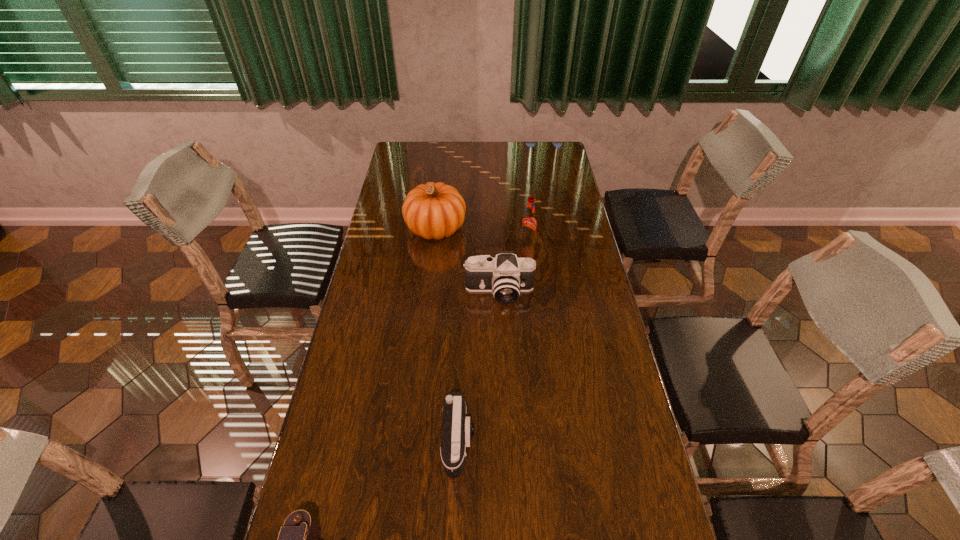
In order to click on vacant space at the far edge of the desktop in this screenshot , I will do `click(458, 144)`.

In the image, there is a desktop. Identify the location of free space at the left edge. Image resolution: width=960 pixels, height=540 pixels. (372, 286).

Locate an element on the screen. vacant region at the right edge of the desktop is located at coordinates (573, 252).

Image resolution: width=960 pixels, height=540 pixels. Identify the location of vacant region at the far right corner of the desktop. (553, 164).

Locate an element on the screen. The height and width of the screenshot is (540, 960). vacant area between the pumpkin and the second farthest camera is located at coordinates (447, 335).

Where is `vacant area that lies between the tallest camera and the second nearest camera`? This screenshot has height=540, width=960. vacant area that lies between the tallest camera and the second nearest camera is located at coordinates (479, 367).

The width and height of the screenshot is (960, 540). I want to click on object that is the second closest to the second nearest camera, so 506,276.

Select which object is the fourth closest to the nearest camera. Please provide its 2D coordinates. Your answer should be formatted as a tuple, i.e. [(x, y)], where the tuple contains the x and y coordinates of a point satisfying the conditions above.

[(529, 221)]

This screenshot has width=960, height=540. Identify the location of camera that is the closest to the root beer. (506, 276).

Find the location of a particular element. Image resolution: width=960 pixels, height=540 pixels. the closest camera to the third nearest object is located at coordinates (457, 430).